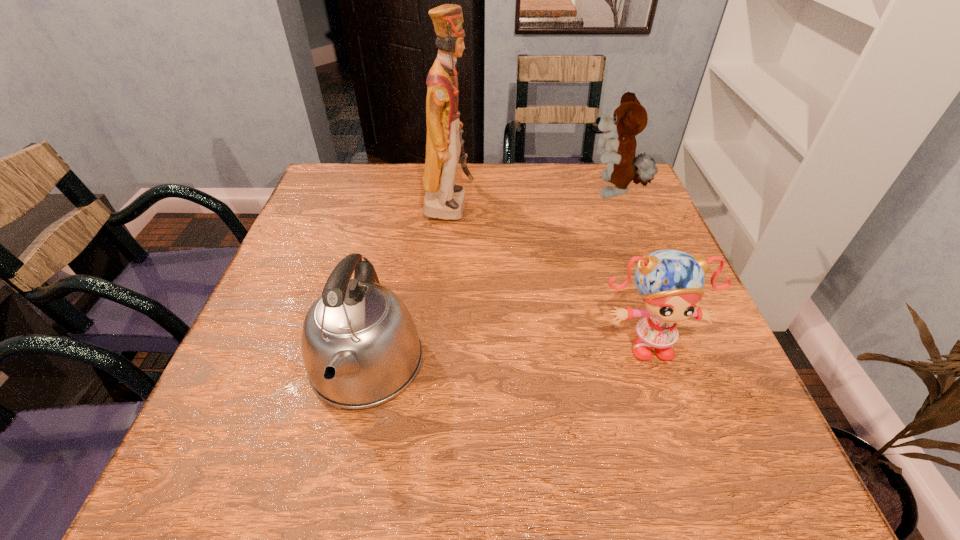
Identify the location of vacant space that's between the kettle and the tallest object. This screenshot has height=540, width=960. (408, 285).

Locate an element on the screen. the second closest object to the kettle is located at coordinates (670, 281).

Identify the location of object that is the second closest to the kettle. The image size is (960, 540). (670, 281).

This screenshot has height=540, width=960. I want to click on vacant space that satisfies the following two spatial constraints: 1. on the front-facing side of the nutcracker; 2. on the spout of the kettle, so click(436, 364).

Where is `free space in the image that satisfies the following two spatial constraints: 1. on the front-facing side of the tallest object; 2. on the spout of the kettle`? This screenshot has height=540, width=960. free space in the image that satisfies the following two spatial constraints: 1. on the front-facing side of the tallest object; 2. on the spout of the kettle is located at coordinates pyautogui.click(x=436, y=364).

Locate an element on the screen. free space that satisfies the following two spatial constraints: 1. on the front-facing side of the tallest object; 2. on the spout of the kettle is located at coordinates (436, 364).

The image size is (960, 540). In order to click on free space that satisfies the following two spatial constraints: 1. on the face of the puppy; 2. on the face of the doll in this screenshot , I will do `click(673, 340)`.